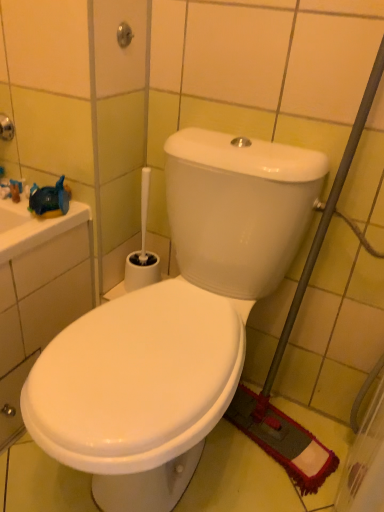
Question: Can you confirm if white glossy toilet at center is positioned to the left of brushed metal showerhead at upper center?

Choices:
 (A) no
 (B) yes

Answer: (A)

Question: Would you say white glossy toilet at center contains brushed metal showerhead at upper center?

Choices:
 (A) yes
 (B) no

Answer: (B)

Question: Is white glossy toilet at center closer to camera compared to brushed metal showerhead at upper center?

Choices:
 (A) yes
 (B) no

Answer: (A)

Question: Can you confirm if white glossy toilet at center is taller than brushed metal showerhead at upper center?

Choices:
 (A) yes
 (B) no

Answer: (A)

Question: Is white glossy toilet at center not close to brushed metal showerhead at upper center?

Choices:
 (A) yes
 (B) no

Answer: (B)

Question: Would you say brushed metal showerhead at upper center is to the left or to the right of white plastic toilet brush at lower center in the picture?

Choices:
 (A) right
 (B) left

Answer: (B)

Question: Considering the positions of brushed metal showerhead at upper center and white plastic toilet brush at lower center in the image, is brushed metal showerhead at upper center taller or shorter than white plastic toilet brush at lower center?

Choices:
 (A) tall
 (B) short

Answer: (B)

Question: Looking at the image, does brushed metal showerhead at upper center seem bigger or smaller compared to white plastic toilet brush at lower center?

Choices:
 (A) big
 (B) small

Answer: (B)

Question: In the image, is brushed metal showerhead at upper center positioned in front of or behind white plastic toilet brush at lower center?

Choices:
 (A) front
 (B) behind

Answer: (A)

Question: Considering the positions of point (66, 357) and point (148, 282), is point (66, 357) closer or farther from the camera than point (148, 282)?

Choices:
 (A) farther
 (B) closer

Answer: (B)

Question: Is white glossy toilet at center to the left or to the right of white plastic toilet brush at lower center in the image?

Choices:
 (A) right
 (B) left

Answer: (A)

Question: Is white glossy toilet at center spatially inside white plastic toilet brush at lower center, or outside of it?

Choices:
 (A) outside
 (B) inside

Answer: (A)

Question: From the image's perspective, relative to white plastic toilet brush at lower center, is white glossy toilet at center above or below?

Choices:
 (A) below
 (B) above

Answer: (A)

Question: Does point coord(125,42) appear closer or farther from the camera than point coord(158,327)?

Choices:
 (A) farther
 (B) closer

Answer: (A)

Question: Choose the correct answer: Is brushed metal showerhead at upper center inside white glossy toilet at center or outside it?

Choices:
 (A) inside
 (B) outside

Answer: (B)